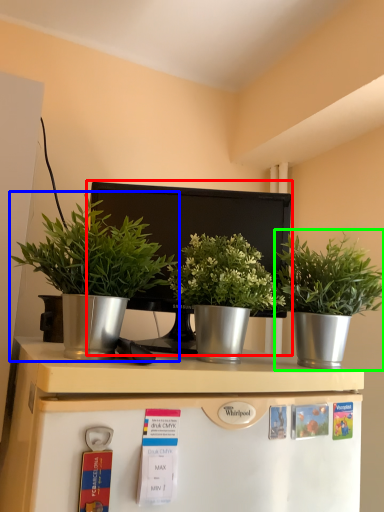
Question: Which is farther away from appliance (highlighted by a red box)? houseplant (highlighted by a blue box) or houseplant (highlighted by a green box)?

Choices:
 (A) houseplant
 (B) houseplant

Answer: (B)